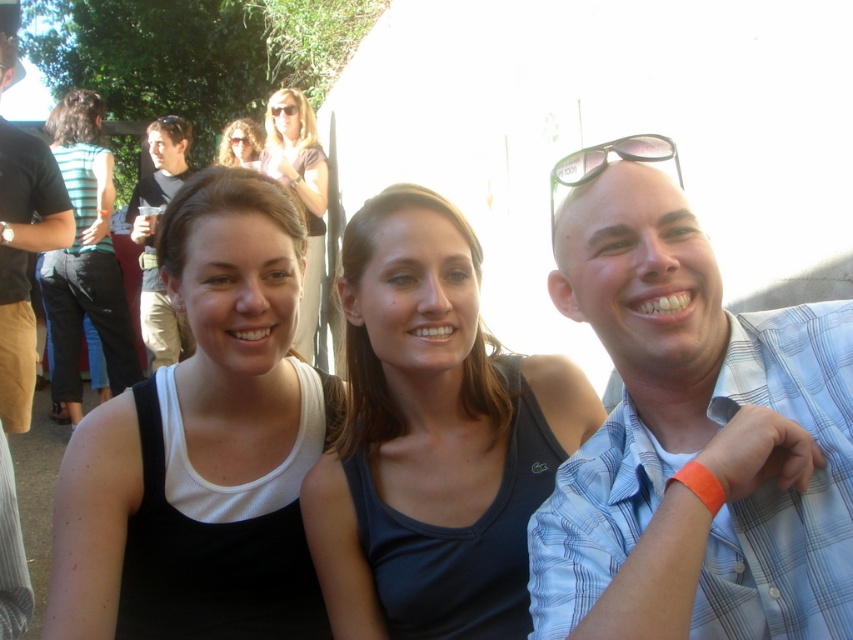
In the image of the social gathering, there are three people standing together. The person on the left is wearing a black tank top, the middle person has a dark tank top, and the person on the right wears a light blue plaid shirt. Given that the coordinates of the black tank top at left are point (85,259), can you determine if this point is closer to the top or bottom of the image?

The coordinates of the black tank top at left are point (85,259). Since the y coordinate is 0.101, which is closer to 0, this point is closer to the top of the image.

You are a photographer trying to capture a closeup of the black tank top at center and the orange fabric wristband at lower left. Which one should you focus on to ensure it appears larger in your photo?

The black tank top at center is closer to the viewer than the orange fabric wristband at lower left, so focusing on it will make it appear larger in the photo.

You are trying to locate the black tank top at center in the image. According to the coordinates provided, where exactly is it positioned?

The black tank top at center is located at point 0.695 on the x axis and 0.239 on the y axis.